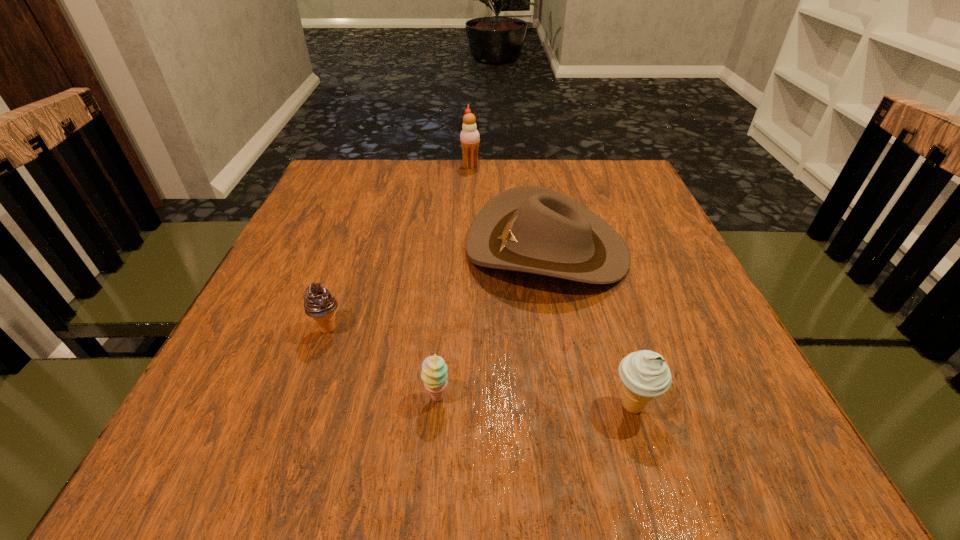
Find the location of `free space located 0.290m with a star on the front of the second farthest object`. free space located 0.290m with a star on the front of the second farthest object is located at coordinates (331, 249).

You are a GUI agent. You are given a task and a screenshot of the screen. Output one action in this format:
    pyautogui.click(x=<x>, y=<y>)
    Task: Click on the vacant space located on the left of the rightmost icecream
    The image size is (960, 540).
    Given the screenshot: What is the action you would take?
    pyautogui.click(x=509, y=407)

In order to click on vacant region located on the back of the leftmost object in this screenshot , I will do pos(356,248).

Where is `vacant space situated on the left of the sherbert`? This screenshot has width=960, height=540. vacant space situated on the left of the sherbert is located at coordinates (280, 397).

The width and height of the screenshot is (960, 540). I want to click on object that is positioned at the far edge, so click(x=469, y=137).

Locate an element on the screen. object present at the near edge is located at coordinates (645, 374).

Where is `object that is positioned at the left edge`? This screenshot has height=540, width=960. object that is positioned at the left edge is located at coordinates (319, 304).

Locate an element on the screen. Image resolution: width=960 pixels, height=540 pixels. object that is at the right edge is located at coordinates (531, 229).

This screenshot has width=960, height=540. Find the location of `vacant space at the far edge of the desktop`. vacant space at the far edge of the desktop is located at coordinates (494, 165).

The height and width of the screenshot is (540, 960). Identify the location of vacant space at the near edge of the desktop. (587, 477).